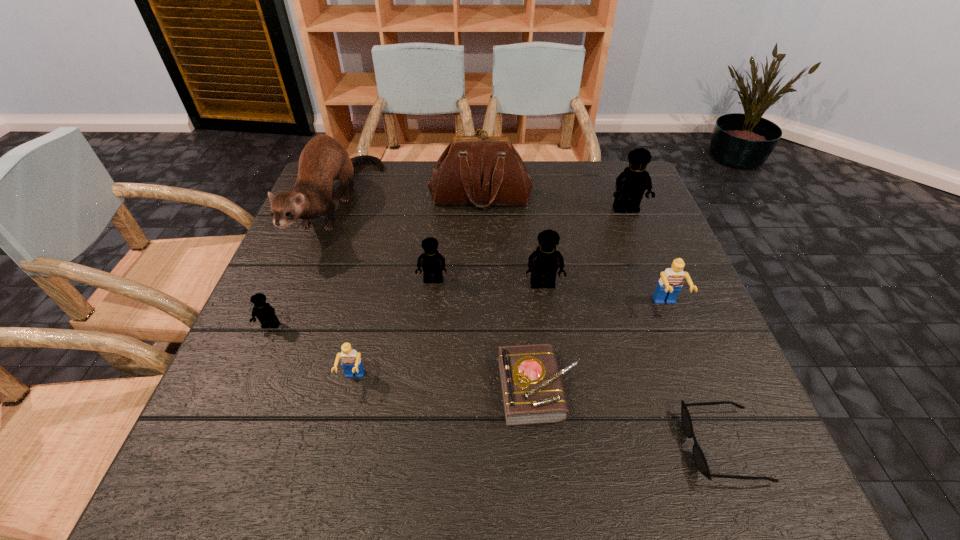
At what (x,y) coordinates should I click in order to perform the action: click on ferret present at the far edge. Please return your answer as a coordinate pair (x, y). The width and height of the screenshot is (960, 540). Looking at the image, I should click on (323, 159).

Locate an element on the screen. The height and width of the screenshot is (540, 960). Lego located at the far edge is located at coordinates (631, 184).

Image resolution: width=960 pixels, height=540 pixels. I want to click on object at the near edge, so click(698, 455).

Locate an element on the screen. The height and width of the screenshot is (540, 960). ferret that is at the left edge is located at coordinates (323, 159).

Find the location of `Lego present at the left edge`. Lego present at the left edge is located at coordinates (265, 313).

Find the location of a particular element. This screenshot has height=540, width=960. sunglasses located at the right edge is located at coordinates (698, 455).

The height and width of the screenshot is (540, 960). What are the coordinates of `object that is positioned at the far left corner` in the screenshot? It's located at (323, 159).

What are the coordinates of `object present at the far right corner` in the screenshot? It's located at (631, 184).

The width and height of the screenshot is (960, 540). What are the coordinates of `object that is positioned at the near right corner` in the screenshot? It's located at (698, 455).

Locate an element on the screen. This screenshot has height=540, width=960. vacant area at the far edge of the desktop is located at coordinates point(423,162).